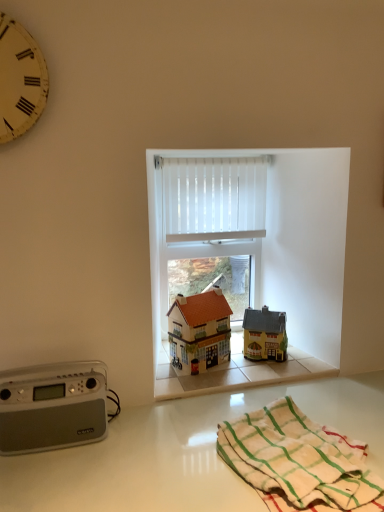
At what (x,y) coordinates should I click in order to perform the action: click on white cotton towel at lower right. Please return your answer as a coordinate pair (x, y). The height and width of the screenshot is (512, 384). Looking at the image, I should click on (299, 461).

This screenshot has height=512, width=384. What do you see at coordinates (299, 461) in the screenshot?
I see `white cotton towel at lower right` at bounding box center [299, 461].

What is the approximate width of yellow matte house at center, the second toy in the left-to-right sequence?

It is 4.40 inches.

Where is `matte orange roofed house at center, the first toy in the left-to-right sequence`? matte orange roofed house at center, the first toy in the left-to-right sequence is located at coordinates (200, 329).

Locate an element on the screen. The height and width of the screenshot is (512, 384). yellow painted wood clock at upper left is located at coordinates (20, 80).

Describe the element at coordinates (213, 198) in the screenshot. The height and width of the screenshot is (512, 384). I see `white vertical blinds at center` at that location.

At what (x,y) coordinates should I click in order to perform the action: click on white glossy countertop at lower center. Please return your answer as a coordinate pair (x, y). Looking at the image, I should click on (183, 451).

Which of these two, yellow painted wood clock at upper left or gray plastic stereo at lower left, is bigger?

gray plastic stereo at lower left is bigger.

Is yellow painted wood clock at upper left situated inside gray plastic stereo at lower left or outside?

yellow painted wood clock at upper left is spatially situated outside gray plastic stereo at lower left.

Between yellow painted wood clock at upper left and gray plastic stereo at lower left, which one appears on the right side from the viewer's perspective?

Positioned to the right is gray plastic stereo at lower left.

Considering the positions of objects yellow painted wood clock at upper left and gray plastic stereo at lower left in the image provided, who is in front, yellow painted wood clock at upper left or gray plastic stereo at lower left?

yellow painted wood clock at upper left is more forward.

Is white vertical blinds at center thinner than white cotton towel at lower right?

Yes, white vertical blinds at center is thinner than white cotton towel at lower right.

Can you tell me how much white vertical blinds at center and white cotton towel at lower right differ in facing direction?

The angle between the facing direction of white vertical blinds at center and the facing direction of white cotton towel at lower right is 0.702 degrees.

Is white vertical blinds at center inside or outside of white cotton towel at lower right?

white vertical blinds at center lies outside white cotton towel at lower right.

Between white glossy countertop at lower center and yellow painted wood clock at upper left, which one has less height?

Standing shorter between the two is yellow painted wood clock at upper left.

Consider the image. Looking at their sizes, would you say white glossy countertop at lower center is wider or thinner than yellow painted wood clock at upper left?

In the image, white glossy countertop at lower center appears to be wider than yellow painted wood clock at upper left.

From the image's perspective, is white glossy countertop at lower center above yellow painted wood clock at upper left?

Actually, white glossy countertop at lower center appears below yellow painted wood clock at upper left in the image.

Is white glossy countertop at lower center facing towards yellow painted wood clock at upper left?

No, white glossy countertop at lower center is not facing towards yellow painted wood clock at upper left.

Is the position of white glossy countertop at lower center more distant than that of yellow matte house at center, the first toy viewed from the right?

No, it is in front of yellow matte house at center, the first toy viewed from the right.

From the picture: Is white glossy countertop at lower center shorter than yellow matte house at center, the second toy in the left-to-right sequence?

In fact, white glossy countertop at lower center may be taller than yellow matte house at center, the second toy in the left-to-right sequence.

Which of these two, white glossy countertop at lower center or yellow matte house at center, the first toy viewed from the right, is thinner?

yellow matte house at center, the first toy viewed from the right.

Is yellow painted wood clock at upper left placed right next to white vertical blinds at center?

No.

Considering the positions of objects yellow painted wood clock at upper left and white vertical blinds at center in the image provided, who is behind, yellow painted wood clock at upper left or white vertical blinds at center?

white vertical blinds at center is behind.

Based on the photo, from a real-world perspective, which object rests below the other?

In real-world perspective, white vertical blinds at center is lower.

Is point (189, 180) closer to camera compared to point (204, 320)?

No.

Looking at the image, does white vertical blinds at center seem bigger or smaller compared to matte orange roofed house at center, the 2th toy in the right-to-left sequence?

Considering their sizes, white vertical blinds at center takes up less space than matte orange roofed house at center, the 2th toy in the right-to-left sequence.

Which object is closer to the camera, white vertical blinds at center or matte orange roofed house at center, the first toy in the left-to-right sequence?

matte orange roofed house at center, the first toy in the left-to-right sequence.

Based on the photo, could you tell me if white vertical blinds at center is facing matte orange roofed house at center, the first toy in the left-to-right sequence?

No, white vertical blinds at center is not facing towards matte orange roofed house at center, the first toy in the left-to-right sequence.

Which is closer to the camera, (340, 507) or (6, 56)?

Point (340, 507).

Which is more to the left, white cotton towel at lower right or yellow painted wood clock at upper left?

Positioned to the left is yellow painted wood clock at upper left.

Which object is closer to the camera, white cotton towel at lower right or yellow painted wood clock at upper left?

white cotton towel at lower right is more forward.

Find the location of a particular element. The image size is (384, 512). clock that appears above the gray plastic stereo at lower left (from the image's perspective) is located at coordinates (20, 80).

Identify the location of curtain behind the white cotton towel at lower right. This screenshot has width=384, height=512. (213, 198).

Estimate the real-world distances between objects in this image. Which object is further from gray plastic stereo at lower left, yellow matte house at center, the second toy in the left-to-right sequence, or white glossy countertop at lower center?

yellow matte house at center, the second toy in the left-to-right sequence.

Considering their positions, is white glossy countertop at lower center positioned closer to gray plastic stereo at lower left than white vertical blinds at center?

Among the two, white glossy countertop at lower center is located nearer to gray plastic stereo at lower left.

Based on their spatial positions, is white cotton towel at lower right or white vertical blinds at center further from white glossy countertop at lower center?

white vertical blinds at center is positioned further to the anchor white glossy countertop at lower center.

When comparing their distances from white vertical blinds at center, does yellow painted wood clock at upper left or white cotton towel at lower right seem further?

The object further to white vertical blinds at center is white cotton towel at lower right.

Based on their spatial positions, is white cotton towel at lower right or gray plastic stereo at lower left further from matte orange roofed house at center, the first toy in the left-to-right sequence?

The object further to matte orange roofed house at center, the first toy in the left-to-right sequence, is gray plastic stereo at lower left.

Looking at the image, which one is located closer to yellow painted wood clock at upper left, white glossy countertop at lower center or white cotton towel at lower right?

The object closer to yellow painted wood clock at upper left is white glossy countertop at lower center.

When comparing their distances from white cotton towel at lower right, does white vertical blinds at center or gray plastic stereo at lower left seem further?

white vertical blinds at center lies further to white cotton towel at lower right than the other object.

Based on their spatial positions, is yellow painted wood clock at upper left or yellow matte house at center, the first toy viewed from the right, closer to white vertical blinds at center?

The object closer to white vertical blinds at center is yellow matte house at center, the first toy viewed from the right.

The image size is (384, 512). Identify the location of stereo that lies between yellow painted wood clock at upper left and white glossy countertop at lower center from top to bottom. (52, 406).

At what (x,y) coordinates should I click in order to perform the action: click on curtain located between gray plastic stereo at lower left and yellow matte house at center, the first toy viewed from the right, in the left-right direction. Please return your answer as a coordinate pair (x, y). Looking at the image, I should click on (213, 198).

This screenshot has height=512, width=384. What are the coordinates of `stereo located between white cotton towel at lower right and yellow matte house at center, the first toy viewed from the right, in the depth direction` in the screenshot? It's located at (52, 406).

Locate an element on the screen. This screenshot has width=384, height=512. toy between white vertical blinds at center and yellow matte house at center, the second toy in the left-to-right sequence, in the vertical direction is located at coordinates (200, 329).